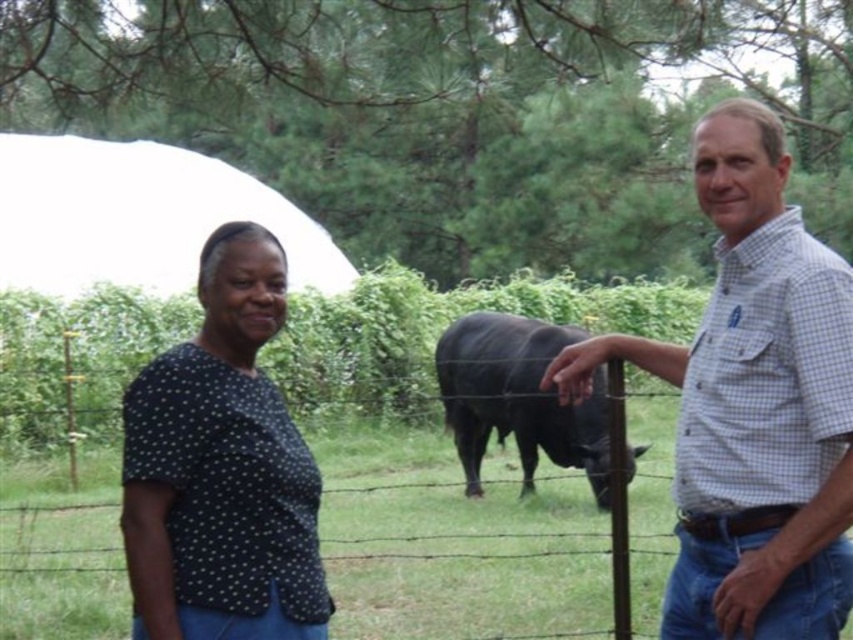
Who is higher up, white checkered shirt at right or black dotted shirt at center?

Positioned higher is black dotted shirt at center.

Who is taller, white checkered shirt at right or black dotted shirt at center?

With more height is white checkered shirt at right.

Which is in front, point (753, 548) or point (171, 358)?

Point (171, 358)

You are a GUI agent. You are given a task and a screenshot of the screen. Output one action in this format:
    pyautogui.click(x=<x>, y=<y>)
    Task: Click on the white checkered shirt at right
    Image resolution: width=853 pixels, height=640 pixels.
    Given the screenshot: What is the action you would take?
    pyautogui.click(x=753, y=404)

Can you confirm if white checkered shirt at right is thinner than black glossy bull at center?

Yes, white checkered shirt at right is thinner than black glossy bull at center.

Does white checkered shirt at right come in front of black glossy bull at center?

That is True.

This screenshot has height=640, width=853. I want to click on white checkered shirt at right, so click(x=753, y=404).

Find the location of a particular element. The image size is (853, 640). white checkered shirt at right is located at coordinates (753, 404).

Can you confirm if black dotted shirt at center is positioned below black glossy bull at center?

No, black dotted shirt at center is not below black glossy bull at center.

Does black dotted shirt at center have a smaller size compared to black glossy bull at center?

Yes, black dotted shirt at center is smaller than black glossy bull at center.

The width and height of the screenshot is (853, 640). Find the location of `black dotted shirt at center`. black dotted shirt at center is located at coordinates (221, 468).

Where is `black dotted shirt at center`? The height and width of the screenshot is (640, 853). black dotted shirt at center is located at coordinates (221, 468).